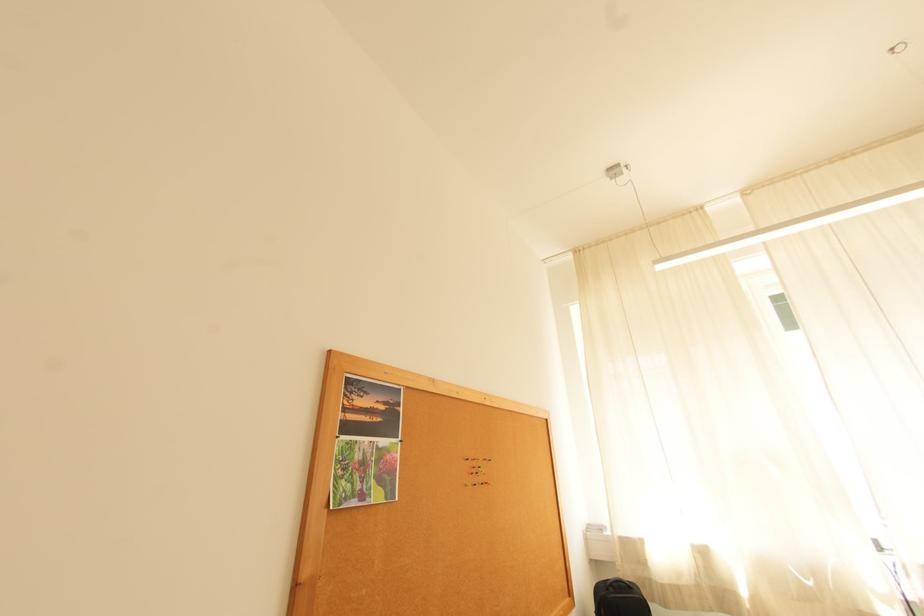
You are a GUI agent. You are given a task and a screenshot of the screen. Output one action in this format:
    pyautogui.click(x=<x>, y=<y>)
    Task: Click on the black backpack
    The height and width of the screenshot is (616, 924).
    Given the screenshot: What is the action you would take?
    pyautogui.click(x=618, y=598)